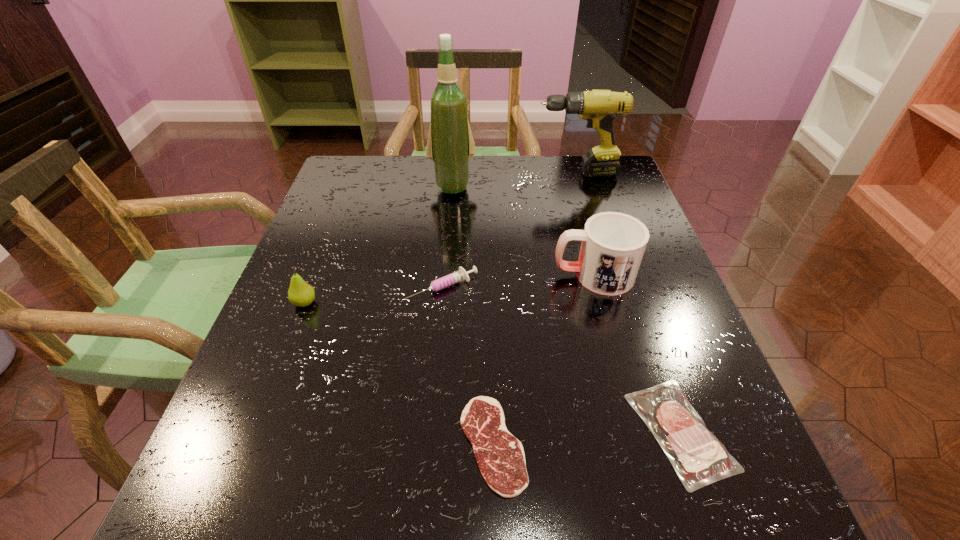
Where is `vacant space located 0.390m on the back of the shortest object`? vacant space located 0.390m on the back of the shortest object is located at coordinates (489, 245).

Locate an element on the screen. wine bottle positioned at the far edge is located at coordinates (450, 144).

You are a GUI agent. You are given a task and a screenshot of the screen. Output one action in this format:
    pyautogui.click(x=<x>, y=<y>)
    Task: Click on the drill present at the far edge
    
    Given the screenshot: What is the action you would take?
    pyautogui.click(x=599, y=107)

The image size is (960, 540). Find the location of `object that is at the left edge`. object that is at the left edge is located at coordinates (301, 294).

Locate an element on the screen. drill that is positioned at the right edge is located at coordinates (x=599, y=107).

Identify the location of mug that is at the right edge. (613, 244).

In order to click on steak present at the right edge in this screenshot , I will do `click(696, 455)`.

Locate an element on the screen. object that is at the far right corner is located at coordinates (599, 107).

Find the location of a particular element. The image size is (960, 540). object situated at the near right corner is located at coordinates (696, 455).

I want to click on vacant space at the far edge, so click(x=564, y=177).